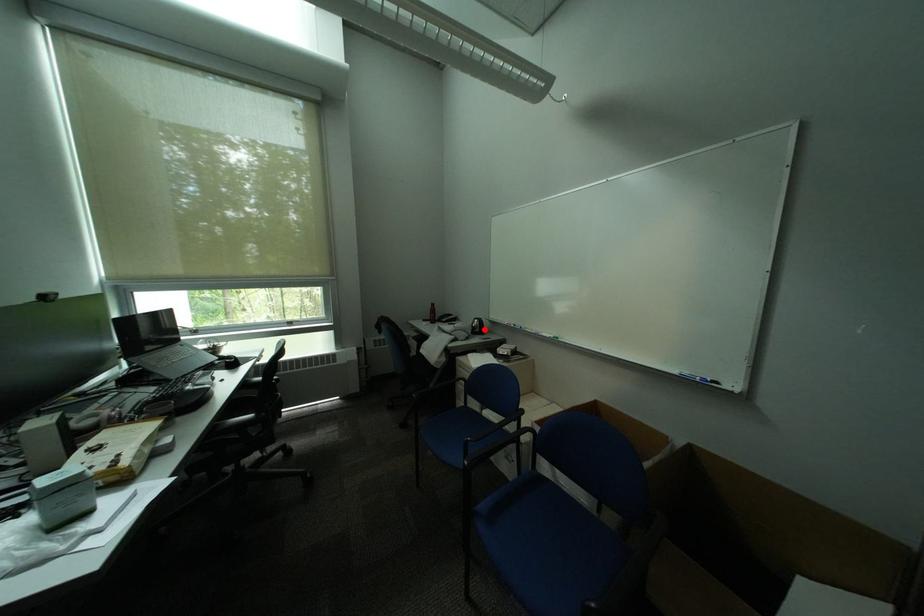
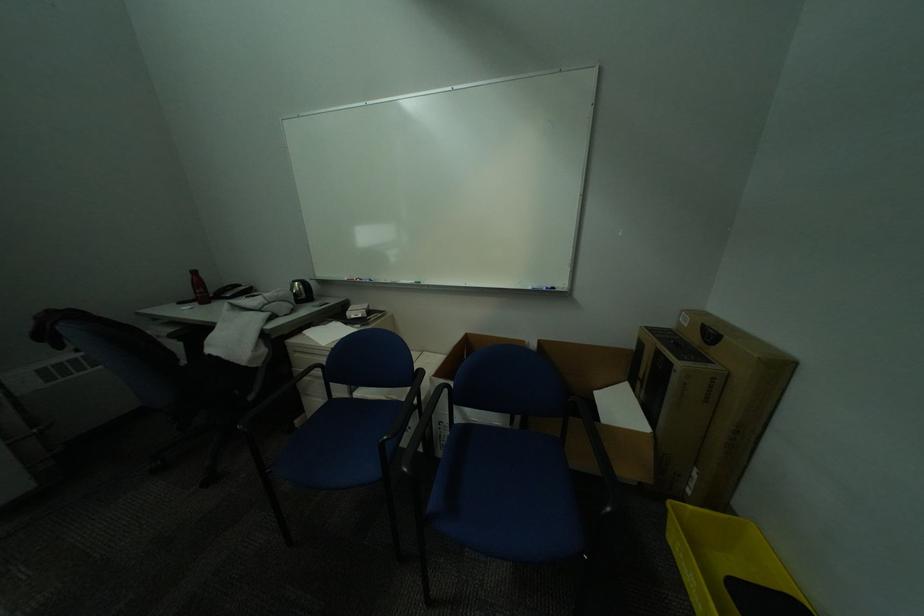
Question: I am providing you with two images of the same scene from different viewpoints. Given a red point in image1, look at the same physical point in image2. Is it:

Choices:
 (A) Closer to the viewpoint
 (B) Farther from the viewpoint

Answer: (A)